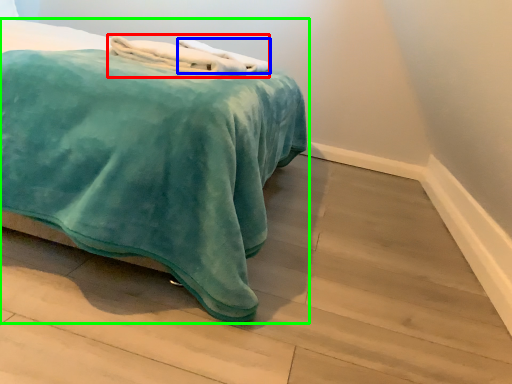
Question: Which is farther away from bath towel (highlighted by a red box)? bath towel (highlighted by a blue box) or bed (highlighted by a green box)?

Choices:
 (A) bath towel
 (B) bed

Answer: (B)